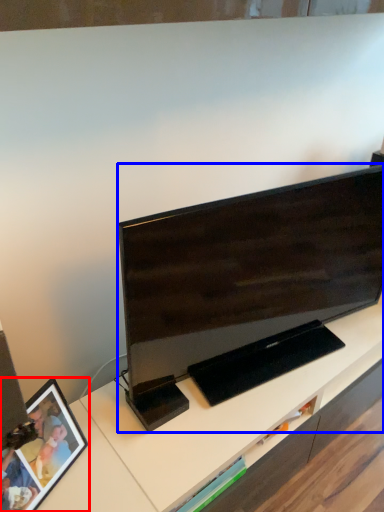
Question: Among these objects, which one is farthest to the camera, picture frame (highlighted by a red box) or television (highlighted by a blue box)?

Choices:
 (A) picture frame
 (B) television

Answer: (B)